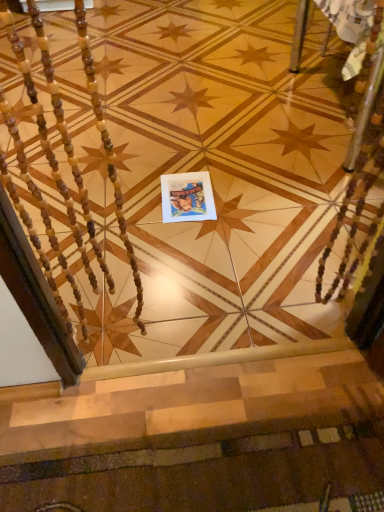
Question: Should I look upward or downward to see carpeted stairs at lower center?

Choices:
 (A) up
 (B) down

Answer: (B)

Question: Is carpeted stairs at lower center taller than matte paper postcard at center?

Choices:
 (A) no
 (B) yes

Answer: (A)

Question: Can you confirm if carpeted stairs at lower center is thinner than matte paper postcard at center?

Choices:
 (A) yes
 (B) no

Answer: (A)

Question: From a real-world perspective, is carpeted stairs at lower center on matte paper postcard at center?

Choices:
 (A) no
 (B) yes

Answer: (B)

Question: Is carpeted stairs at lower center placed right next to matte paper postcard at center?

Choices:
 (A) yes
 (B) no

Answer: (B)

Question: Would you say carpeted stairs at lower center is a long distance from matte paper postcard at center?

Choices:
 (A) no
 (B) yes

Answer: (A)

Question: From the image's perspective, is carpeted stairs at lower center below matte paper postcard at center?

Choices:
 (A) no
 (B) yes

Answer: (B)

Question: Is the depth of matte paper postcard at center less than that of carpeted stairs at lower center?

Choices:
 (A) no
 (B) yes

Answer: (A)

Question: Could you tell me if matte paper postcard at center is facing carpeted stairs at lower center?

Choices:
 (A) yes
 (B) no

Answer: (A)

Question: Considering the relative sizes of matte paper postcard at center and carpeted stairs at lower center in the image provided, is matte paper postcard at center wider than carpeted stairs at lower center?

Choices:
 (A) yes
 (B) no

Answer: (A)

Question: Is matte paper postcard at center not within carpeted stairs at lower center?

Choices:
 (A) no
 (B) yes

Answer: (B)

Question: Is matte paper postcard at center in contact with carpeted stairs at lower center?

Choices:
 (A) no
 (B) yes

Answer: (A)

Question: Does matte paper postcard at center have a lesser width compared to carpeted stairs at lower center?

Choices:
 (A) no
 (B) yes

Answer: (A)

Question: In terms of size, does carpeted stairs at lower center appear bigger or smaller than matte paper postcard at center?

Choices:
 (A) small
 (B) big

Answer: (B)